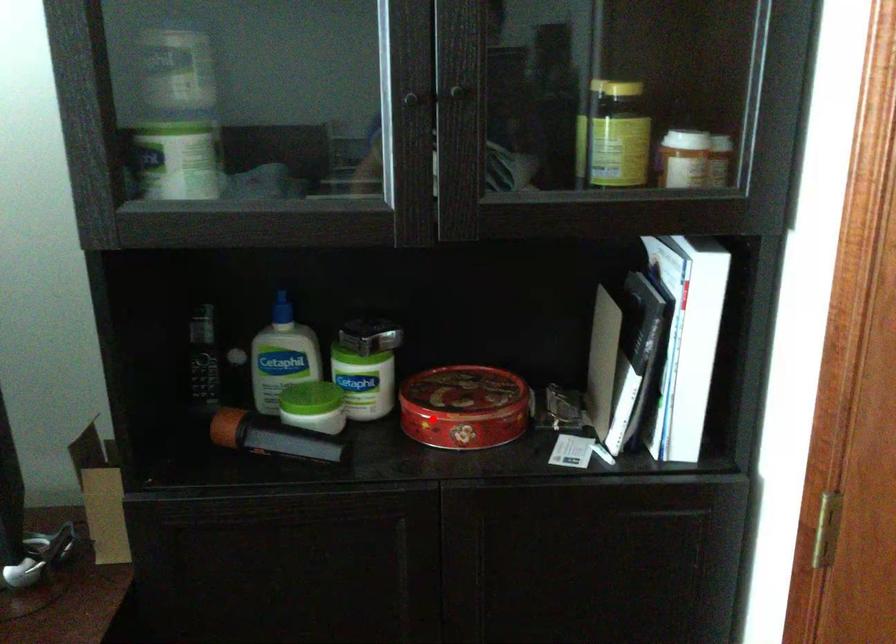
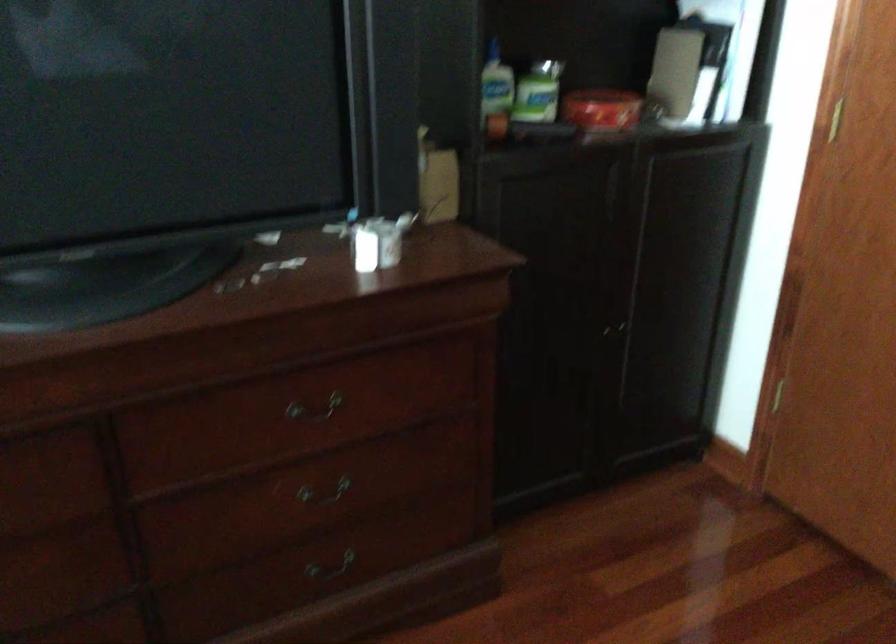
Locate, in the second image, the point that corresponds to the highlighted location in the first image.

(600, 109)